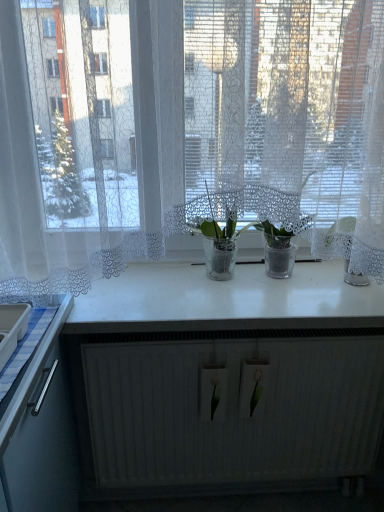
Question: Would you say white matte radiator at lower center is to the left or to the right of transparent glass plants at center in the picture?

Choices:
 (A) left
 (B) right

Answer: (B)

Question: From the image's perspective, relative to transparent glass plants at center, is white matte radiator at lower center above or below?

Choices:
 (A) below
 (B) above

Answer: (A)

Question: Which of these objects is positioned closest to the translucent glass vase at center?

Choices:
 (A) transparent glass plants at center
 (B) white matte radiator at lower center
 (C) white glossy counter top at center

Answer: (C)

Question: Estimate the real-world distances between objects in this image. Which object is closer to the white matte radiator at lower center?

Choices:
 (A) white glossy counter top at center
 (B) translucent glass vase at center
 (C) transparent glass plants at center

Answer: (A)